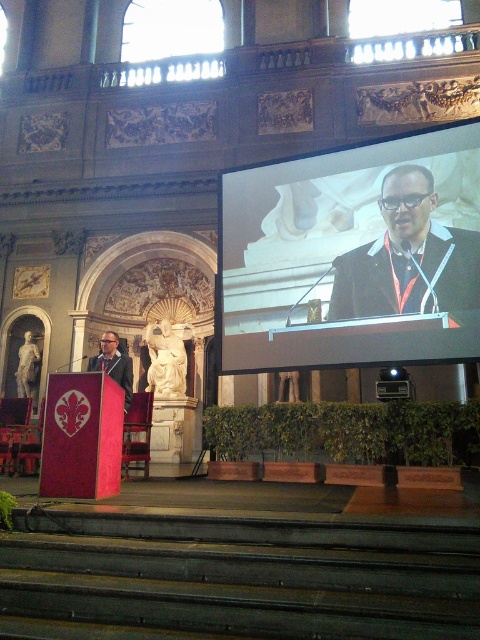
You are standing in the grand hall and want to reach a specific point marked at coordinates point (x=444, y=292). If you can walk 100 feet in 2 minutes, how long will it take you to reach that point?

The distance to point (x=444, y=292) is 87.69 feet. At a walking pace of 100 feet per 2 minutes, it would take approximately 1.75 minutes to reach the point.

You are an attendee at the event and want to take a photo of the speaker. The speaker is wearing a black matte suit at upper center and there is a matte black screen at upper center behind him. Where should you position yourself to ensure the screen is not blocking the speaker in your photo?

Position yourself to the right of the speaker so that the black matte suit at upper center is not obscured by the matte black screen at upper center, which is located to the left of the speaker.